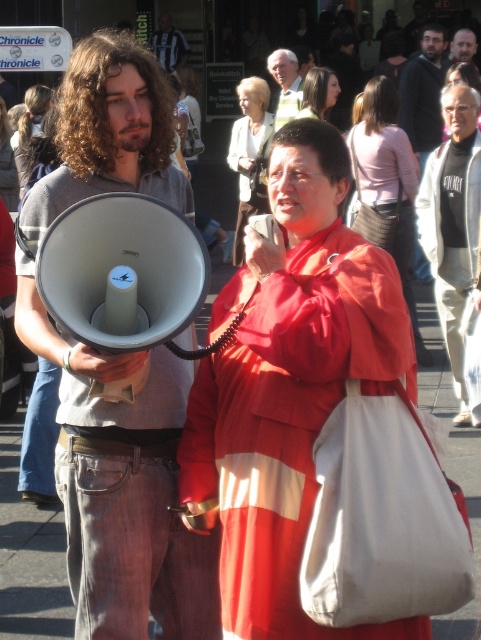
Does white textured coat at center appear over light brown hair at upper center?

Incorrect, white textured coat at center is not positioned above light brown hair at upper center.

Does point (252, 132) come closer to viewer compared to point (285, 58)?

Yes.

Between point (260, 96) and point (295, 76), which one is positioned in front?

Point (260, 96) is in front.

Identify the location of white textured coat at center. The height and width of the screenshot is (640, 481). coord(250,154).

Is white textured coat at center shorter than smooth brown hair at upper center?

Incorrect, white textured coat at center's height does not fall short of smooth brown hair at upper center's.

At what (x,y) coordinates should I click in order to perform the action: click on white textured coat at center. Please return your answer as a coordinate pair (x, y). This screenshot has height=640, width=481. Looking at the image, I should click on (250, 154).

The height and width of the screenshot is (640, 481). I want to click on white textured coat at center, so click(x=250, y=154).

From the picture: How distant is striped jersey at center from smooth skin face at upper right?

The distance of striped jersey at center from smooth skin face at upper right is 7.78 meters.

Which is above, striped jersey at center or smooth skin face at upper right?

striped jersey at center

Between point (168, 24) and point (464, 52), which one is positioned behind?

Positioned behind is point (168, 24).

Locate an element on the screen. The width and height of the screenshot is (481, 640). striped jersey at center is located at coordinates (168, 44).